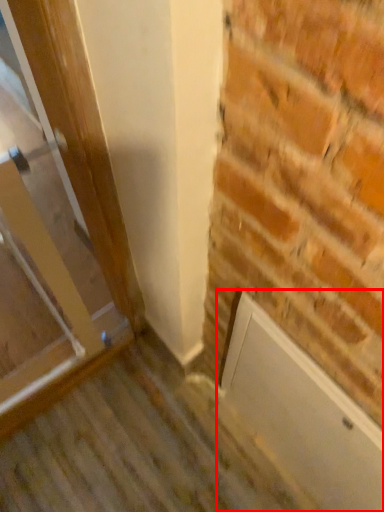
Question: From the image's perspective, where is screen door (annotated by the red box) located relative to door?

Choices:
 (A) below
 (B) above

Answer: (A)